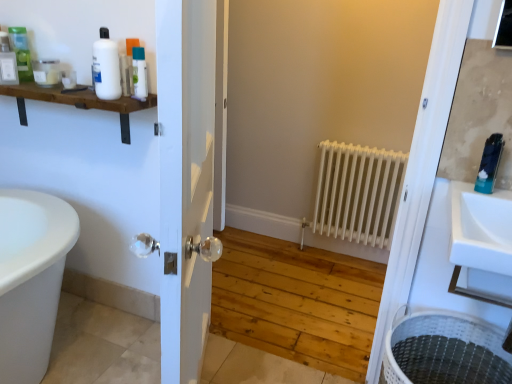
Find the location of a particular element. free space underneath white matte radiator at center (from a real-world perspective) is located at coordinates (340, 262).